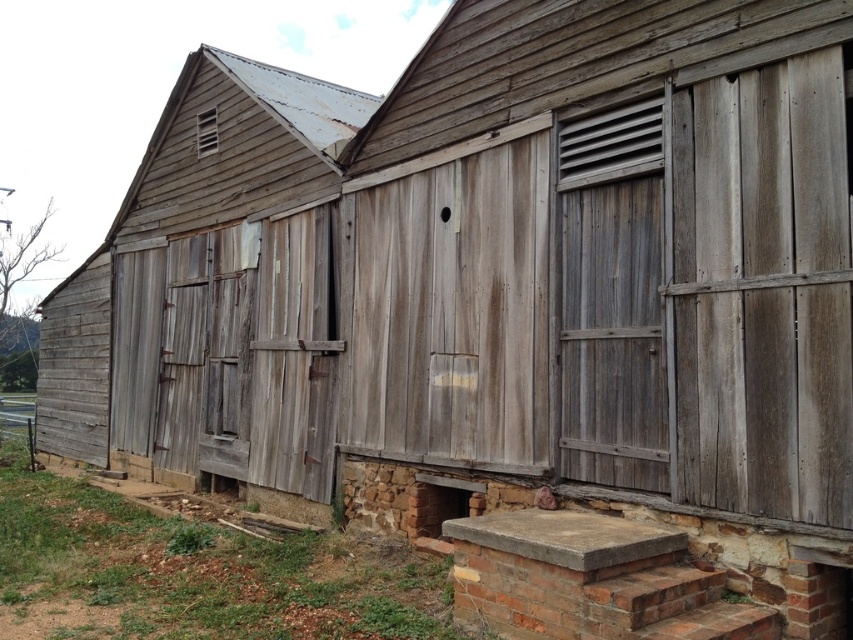
Question: Does weathered wood shutter at right appear on the right side of weathered wood shutter at upper left?

Choices:
 (A) yes
 (B) no

Answer: (A)

Question: Which of the following is the closest to the observer?

Choices:
 (A) (97, 252)
 (B) (202, 112)
 (C) (558, 237)

Answer: (C)

Question: Is weathered wood shutter at right bigger than weathered wood shutter at upper left?

Choices:
 (A) no
 (B) yes

Answer: (B)

Question: Does weathered wood barn at left have a greater width compared to weathered wood shutter at upper left?

Choices:
 (A) yes
 (B) no

Answer: (A)

Question: Estimate the real-world distances between objects in this image. Which object is closer to the weathered wood shutter at upper left?

Choices:
 (A) weathered wood barn at left
 (B) weathered wood shutter at right

Answer: (A)

Question: Which point is farther from the camera taking this photo?

Choices:
 (A) (115, 355)
 (B) (322, 403)
 (C) (199, 128)
 (D) (624, 362)

Answer: (A)